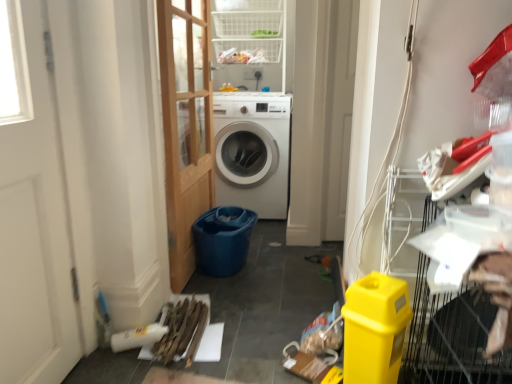
Question: Is wooden planks at lower left further to camera compared to yellow plastic bin at lower right?

Choices:
 (A) yes
 (B) no

Answer: (A)

Question: Does wooden planks at lower left have a lesser width compared to yellow plastic bin at lower right?

Choices:
 (A) no
 (B) yes

Answer: (A)

Question: Is wooden planks at lower left not close to yellow plastic bin at lower right?

Choices:
 (A) yes
 (B) no

Answer: (B)

Question: Does wooden planks at lower left have a greater height compared to yellow plastic bin at lower right?

Choices:
 (A) yes
 (B) no

Answer: (B)

Question: Does wooden planks at lower left have a lesser height compared to yellow plastic bin at lower right?

Choices:
 (A) no
 (B) yes

Answer: (B)

Question: Considering the positions of white plastic shelf at upper center and yellow plastic bin at lower right in the image, is white plastic shelf at upper center wider or thinner than yellow plastic bin at lower right?

Choices:
 (A) wide
 (B) thin

Answer: (A)

Question: In the image, is white plastic shelf at upper center on the left side or the right side of yellow plastic bin at lower right?

Choices:
 (A) left
 (B) right

Answer: (A)

Question: Do you think white plastic shelf at upper center is within yellow plastic bin at lower right, or outside of it?

Choices:
 (A) inside
 (B) outside

Answer: (B)

Question: Considering the positions of point (223, 4) and point (358, 286), is point (223, 4) closer or farther from the camera than point (358, 286)?

Choices:
 (A) farther
 (B) closer

Answer: (A)

Question: Is point (192, 294) positioned closer to the camera than point (352, 332)?

Choices:
 (A) farther
 (B) closer

Answer: (A)

Question: From the image's perspective, is wooden planks at lower left positioned above or below yellow plastic bin at lower right?

Choices:
 (A) above
 (B) below

Answer: (B)

Question: Looking at their shapes, would you say wooden planks at lower left is wider or thinner than yellow plastic bin at lower right?

Choices:
 (A) wide
 (B) thin

Answer: (A)

Question: Based on their positions, is wooden planks at lower left located to the left or right of yellow plastic bin at lower right?

Choices:
 (A) left
 (B) right

Answer: (A)

Question: Relative to white glossy washing machine at center, is blue plastic bucket at center in front or behind?

Choices:
 (A) front
 (B) behind

Answer: (A)

Question: Do you think blue plastic bucket at center is within white glossy washing machine at center, or outside of it?

Choices:
 (A) outside
 (B) inside

Answer: (A)